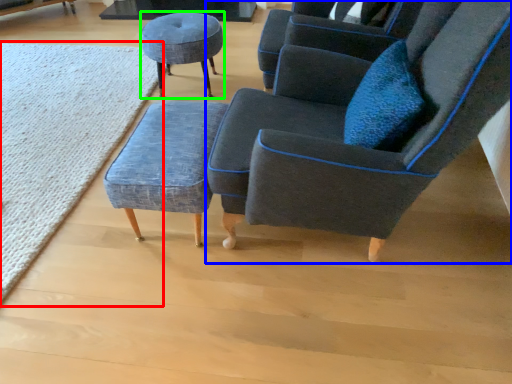
Question: Which object is positioned farthest from mat (highlighted by a red box)? Select from chair (highlighted by a blue box) and stool (highlighted by a green box).

Choices:
 (A) chair
 (B) stool

Answer: (A)